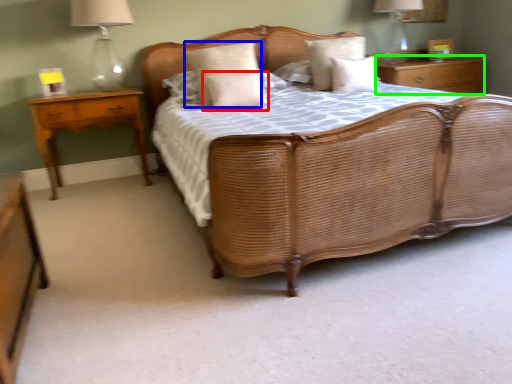
Question: Estimate the real-world distances between objects in this image. Which object is farther from pillow (highlighted by a red box), pillow (highlighted by a blue box) or nightstand (highlighted by a green box)?

Choices:
 (A) pillow
 (B) nightstand

Answer: (B)